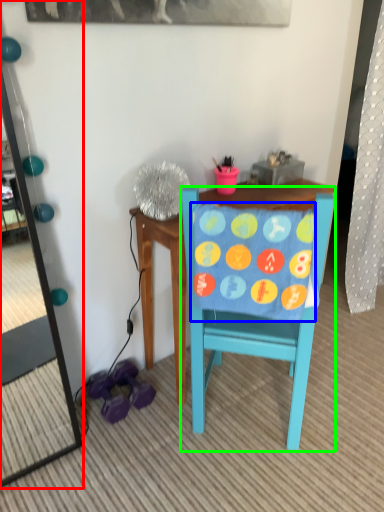
Question: Considering the real-world distances, which object is closest to mirror (highlighted by a red box)? blanket (highlighted by a blue box) or chair (highlighted by a green box).

Choices:
 (A) blanket
 (B) chair

Answer: (B)